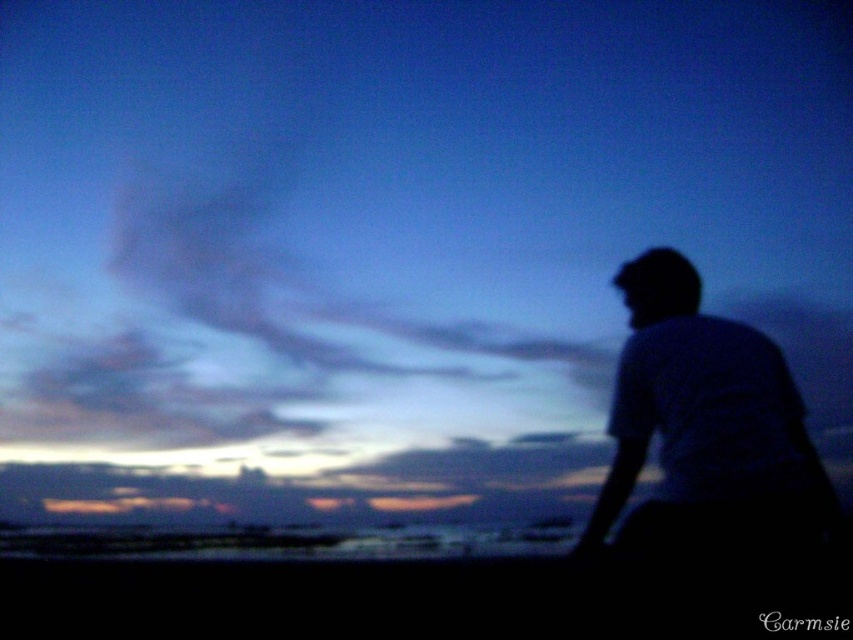
You are an artist trying to sketch the scene. You notice the dark fabric shirt at right and the black matte head at upper right. Which object should you draw first to ensure proper perspective, considering their sizes and positions?

Since the dark fabric shirt at right is larger in size than the black matte head at upper right, you should draw the dark fabric shirt at right first to establish the correct perspective and scale before adding the smaller black matte head at upper right.

You are an artist trying to sketch this scene. You want to ensure the dark fabric shirt at right and the black matte head at upper right are placed correctly. Which object should be drawn first to maintain their spatial relationship?

The black matte head at upper right should be drawn first because the dark fabric shirt at right is positioned under it, meaning the shirt is lower in the image and would be placed beneath the head in the final composition.